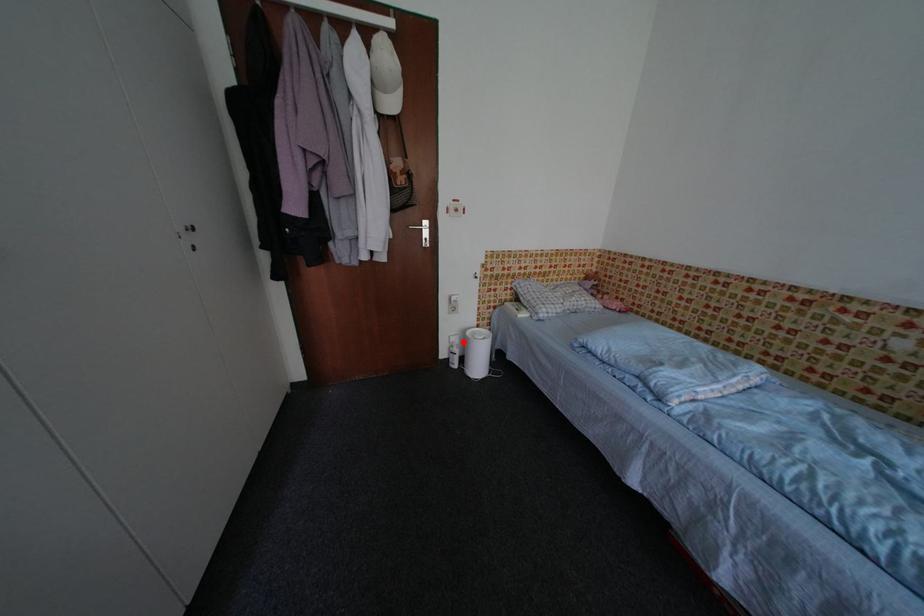
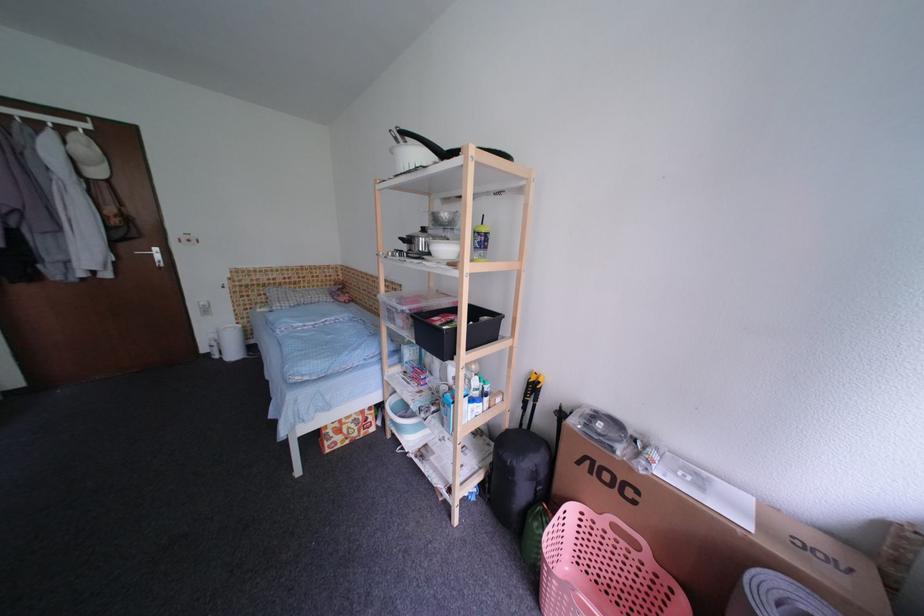
Question: I am providing you with two images of the same scene from different viewpoints. Image1 has a red point marked. In image2, the corresponding 3D location appears at what relative position? Reply with the corresponding letter.

Choices:
 (A) Closer
 (B) Farther

Answer: (A)